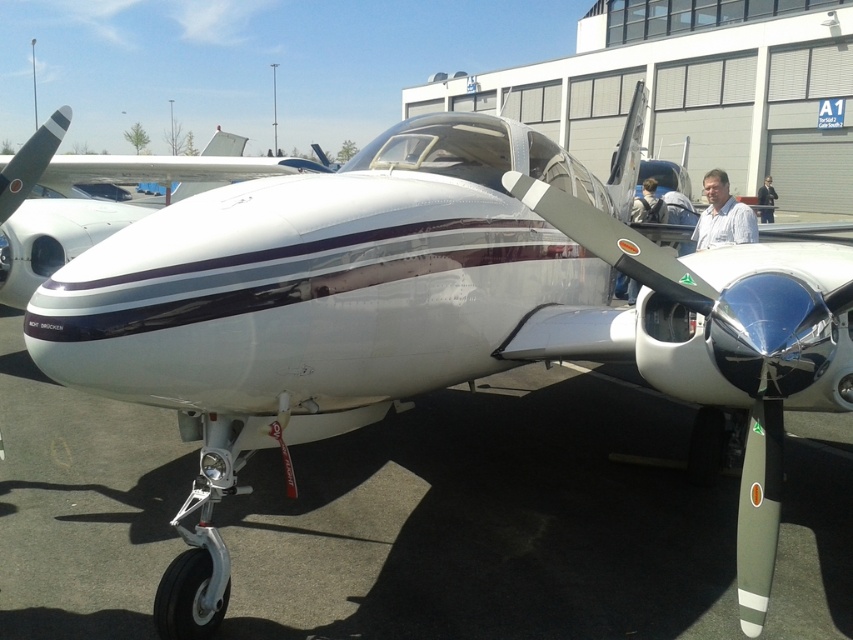
Based on the photo, does white glossy airplane at center appear on the right side of white shirt at center?

In fact, white glossy airplane at center is to the left of white shirt at center.

From the picture: Between white glossy airplane at center and white shirt at center, which one has less height?

Standing shorter between the two is white shirt at center.

Which is behind, point (19, 291) or point (749, 228)?

Point (19, 291)

In order to click on white glossy airplane at center in this screenshot , I will do `click(91, 200)`.

Does white shirt at center appear on the left side of matte black backpack at center?

Indeed, white shirt at center is positioned on the left side of matte black backpack at center.

Does white shirt at center have a lesser width compared to matte black backpack at center?

In fact, white shirt at center might be wider than matte black backpack at center.

Between point (706, 172) and point (654, 211), which one is positioned in front?

Point (654, 211)

You are a GUI agent. You are given a task and a screenshot of the screen. Output one action in this format:
    pyautogui.click(x=<x>, y=<y>)
    Task: Click on the white shirt at center
    The width and height of the screenshot is (853, 640).
    Given the screenshot: What is the action you would take?
    pyautogui.click(x=722, y=216)

Between polished silver propeller at center and black fabric jacket at center, which one is positioned lower?

Positioned lower is polished silver propeller at center.

Image resolution: width=853 pixels, height=640 pixels. Find the location of `polished silver propeller at center`. polished silver propeller at center is located at coordinates (727, 346).

Find the location of `polished silver propeller at center`. polished silver propeller at center is located at coordinates (727, 346).